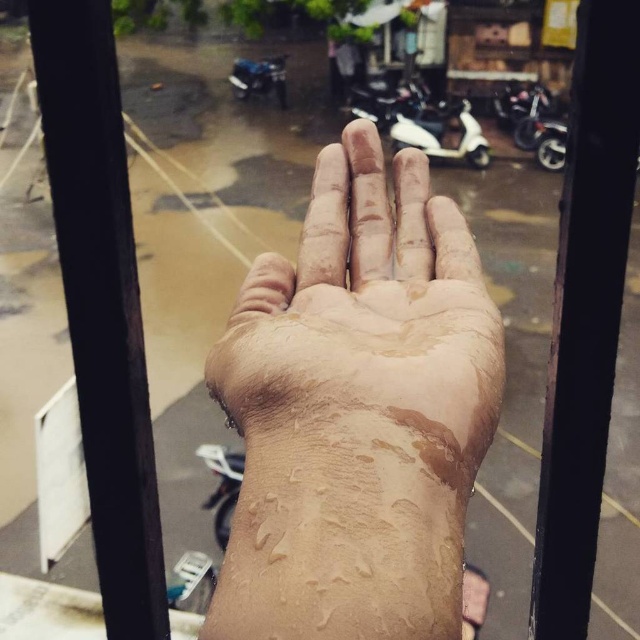
Looking at this image, can you confirm if white glossy scooter at center is shorter than blue metallic motorcycle at upper center?

No, white glossy scooter at center is not shorter than blue metallic motorcycle at upper center.

The image size is (640, 640). In order to click on white glossy scooter at center in this screenshot , I will do `click(444, 134)`.

Can you confirm if dry skin at center is positioned to the left of white glossy scooter at center?

Correct, you'll find dry skin at center to the left of white glossy scooter at center.

The width and height of the screenshot is (640, 640). Describe the element at coordinates (364, 320) in the screenshot. I see `dry skin at center` at that location.

Where is `dry skin at center`? Image resolution: width=640 pixels, height=640 pixels. dry skin at center is located at coordinates tap(364, 320).

Which is behind, point (408, 205) or point (280, 54)?

The point (280, 54) is more distant.

Does point (364, 413) come farther from viewer compared to point (276, 54)?

No, it is in front of (276, 54).

Is point (342, 461) farther from camera compared to point (256, 68)?

No.

Find the location of `dry skin at center`. dry skin at center is located at coordinates (364, 320).